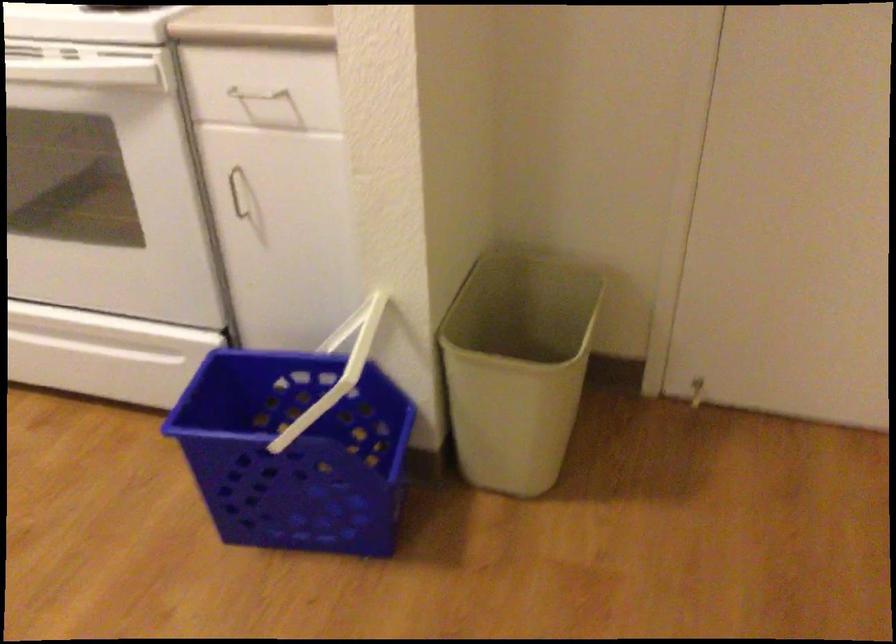
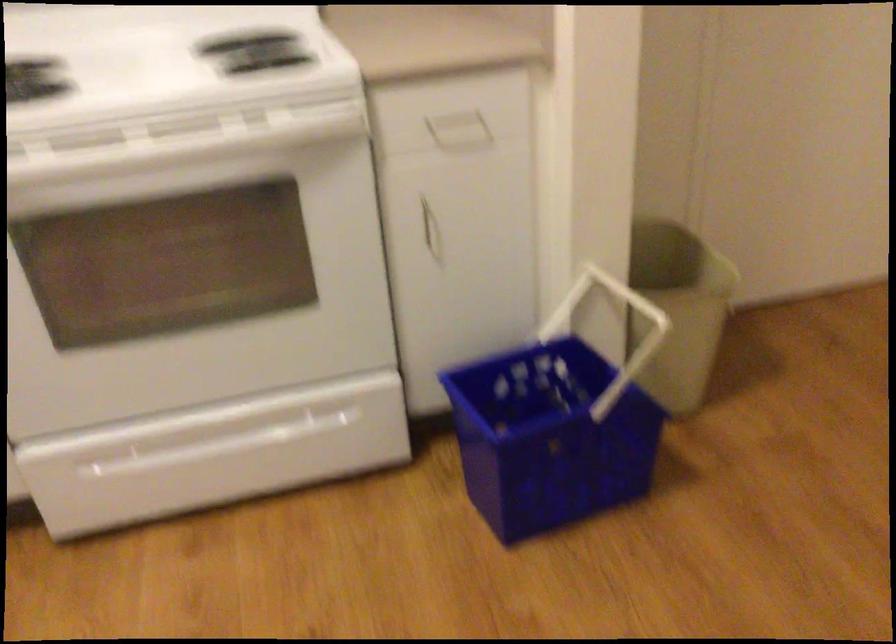
Find the pixel in the second image that matches (x=254, y=216) in the first image.

(431, 234)